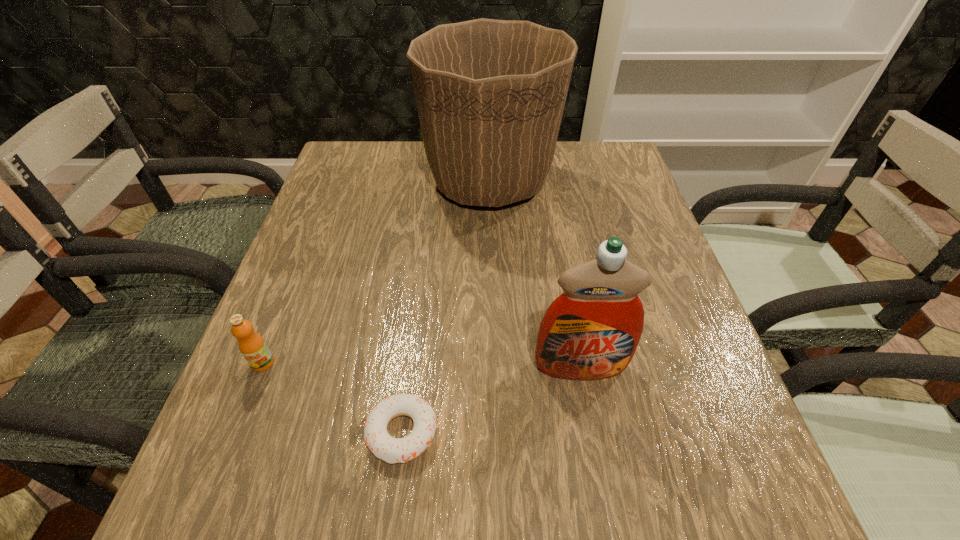
Locate which object is the second closest to the leftmost object. Please provide its 2D coordinates. Your answer should be formatted as a tuple, i.e. [(x, y)], where the tuple contains the x and y coordinates of a point satisfying the conditions above.

[(490, 93)]

At what (x,y) coordinates should I click in order to perform the action: click on object that is the third closest to the flowerpot. Please return your answer as a coordinate pair (x, y). This screenshot has width=960, height=540. Looking at the image, I should click on (392, 450).

Identify the location of free point that satisfies the following two spatial constraints: 1. on the back side of the flowerpot; 2. on the right side of the doughnut. Image resolution: width=960 pixels, height=540 pixels. (434, 181).

Identify the location of vacant area in the image that satisfies the following two spatial constraints: 1. on the front label of the doughnut; 2. on the left side of the third tallest object. (235, 432).

The width and height of the screenshot is (960, 540). What are the coordinates of `free space that satisfies the following two spatial constraints: 1. on the front label of the leftmost object; 2. on the right side of the nearest object` in the screenshot? It's located at (235, 432).